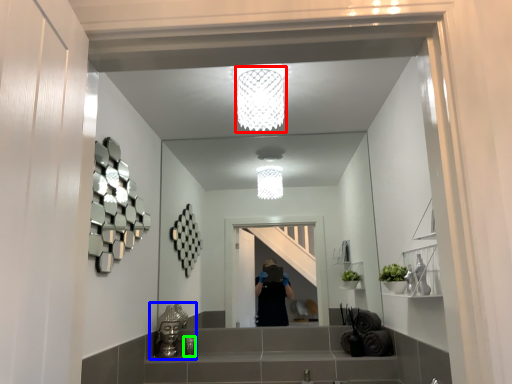
Question: Estimate the real-world distances between objects in this image. Which object is closer to light fixture (highlighted by a red box), sink (highlighted by a blue box) or toiletry (highlighted by a green box)?

Choices:
 (A) sink
 (B) toiletry

Answer: (A)